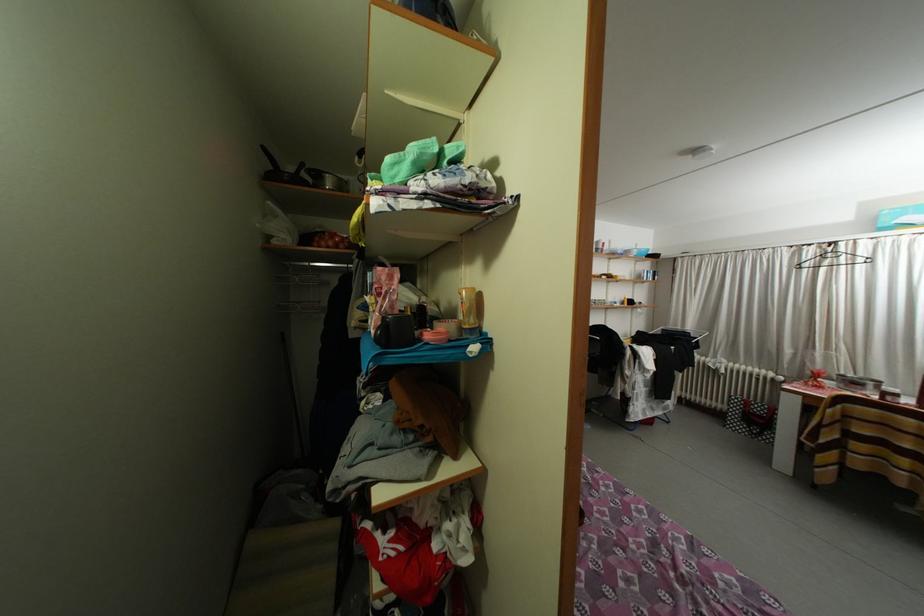
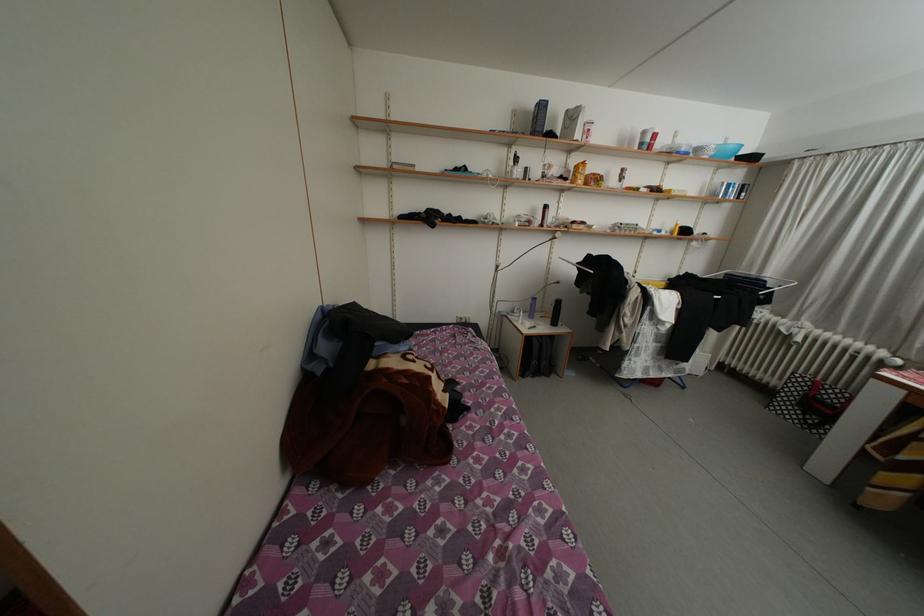
Question: The first image is from the beginning of the video and the second image is from the end. How did the camera likely rotate when shooting the video?

Choices:
 (A) Left
 (B) Right
 (C) Up
 (D) Down

Answer: (D)